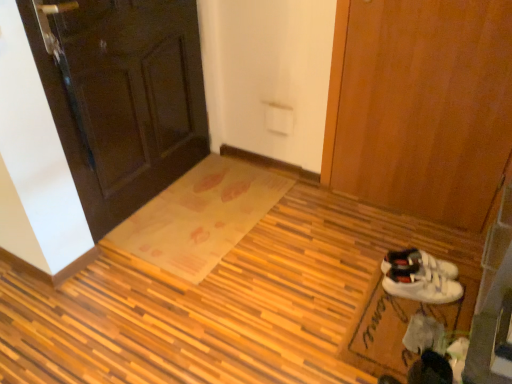
Where is `vacant space in front of white suede sneakers at lower right`? vacant space in front of white suede sneakers at lower right is located at coordinates (414, 323).